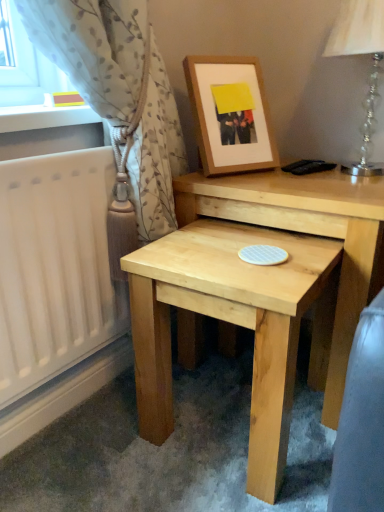
Question: Considering the relative sizes of light beige textured curtain at left and clear crystal glass table lamp at upper right in the image provided, is light beige textured curtain at left shorter than clear crystal glass table lamp at upper right?

Choices:
 (A) yes
 (B) no

Answer: (B)

Question: Is clear crystal glass table lamp at upper right inside light beige textured curtain at left?

Choices:
 (A) yes
 (B) no

Answer: (B)

Question: Is light beige textured curtain at left thinner than clear crystal glass table lamp at upper right?

Choices:
 (A) yes
 (B) no

Answer: (A)

Question: From a real-world perspective, is light beige textured curtain at left under clear crystal glass table lamp at upper right?

Choices:
 (A) no
 (B) yes

Answer: (B)

Question: Considering the relative positions of light beige textured curtain at left and clear crystal glass table lamp at upper right in the image provided, is light beige textured curtain at left behind clear crystal glass table lamp at upper right?

Choices:
 (A) no
 (B) yes

Answer: (A)

Question: Is point (193, 194) closer or farther from the camera than point (157, 413)?

Choices:
 (A) farther
 (B) closer

Answer: (A)

Question: Is natural wood table at center, the first table from the back, wider or thinner than natural wood table at lower center, the first table in the front-to-back sequence?

Choices:
 (A) wide
 (B) thin

Answer: (A)

Question: Is natural wood table at center, the first table from the back, bigger or smaller than natural wood table at lower center, placed as the 2th table when sorted from back to front?

Choices:
 (A) big
 (B) small

Answer: (A)

Question: From a real-world perspective, relative to natural wood table at lower center, placed as the 2th table when sorted from back to front, is natural wood table at center, the first table from the back, vertically above or below?

Choices:
 (A) below
 (B) above

Answer: (B)

Question: From a real-world perspective, is clear crystal glass table lamp at upper right positioned above or below natural wood table at center, the 2th table in the front-to-back sequence?

Choices:
 (A) below
 (B) above

Answer: (B)

Question: In terms of width, does clear crystal glass table lamp at upper right look wider or thinner when compared to natural wood table at center, the 2th table in the front-to-back sequence?

Choices:
 (A) wide
 (B) thin

Answer: (B)

Question: Is clear crystal glass table lamp at upper right spatially inside natural wood table at center, the 2th table in the front-to-back sequence, or outside of it?

Choices:
 (A) outside
 (B) inside

Answer: (A)

Question: In terms of height, does clear crystal glass table lamp at upper right look taller or shorter compared to natural wood table at center, the first table from the back?

Choices:
 (A) short
 (B) tall

Answer: (A)

Question: Is natural wood table at center, the first table from the back, inside or outside of light beige textured curtain at left?

Choices:
 (A) inside
 (B) outside

Answer: (B)

Question: From a real-world perspective, is natural wood table at center, the 2th table in the front-to-back sequence, above or below light beige textured curtain at left?

Choices:
 (A) below
 (B) above

Answer: (A)